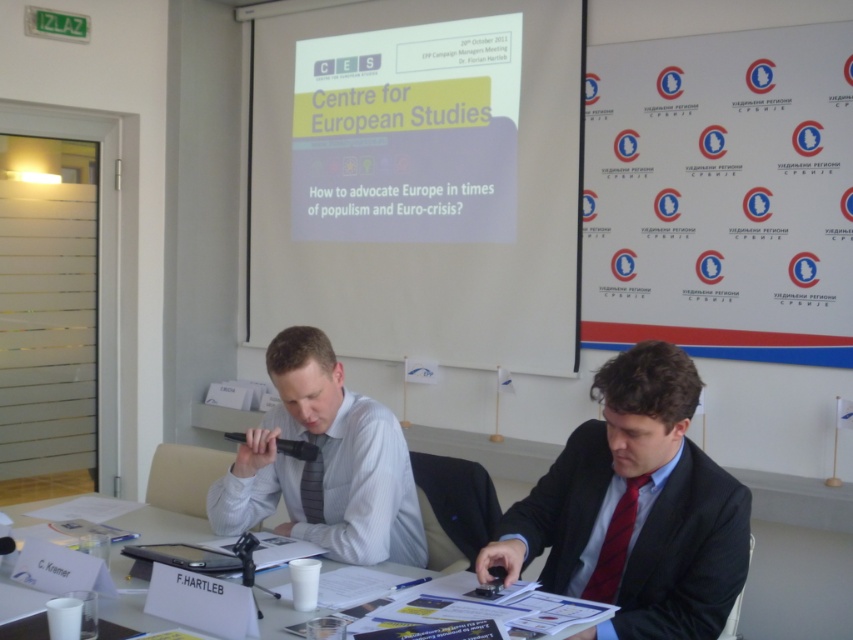
In the scene shown: You are an attendee at this meeting and need to present a slide. The projector is connected to the screen. Can you see your presentation on the white matte projector screen at upper center from where the white striped shirt at center is located?

The white matte projector screen at upper center is larger in size than the white striped shirt at center, so yes, the presenter at the white striped shirt at center can see their presentation on the white matte projector screen at upper center as it is large enough to be visible from their position.

You are an attendee at this meeting and need to present a slide. The projector is connected to the screen. To ensure your slides are visible, where should you stand relative to the white matte projector screen at upper center?

To ensure visibility, you should stand to the side of the white matte projector screen at upper center so that you don not block the projection. Since the screen is at point (419, 179), positioning yourself to the left or right would be ideal.